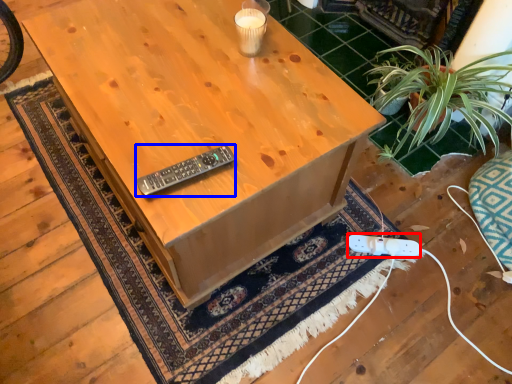
Question: Which of the following is the farthest to the observer, plug (highlighted by a red box) or control (highlighted by a blue box)?

Choices:
 (A) plug
 (B) control

Answer: (A)